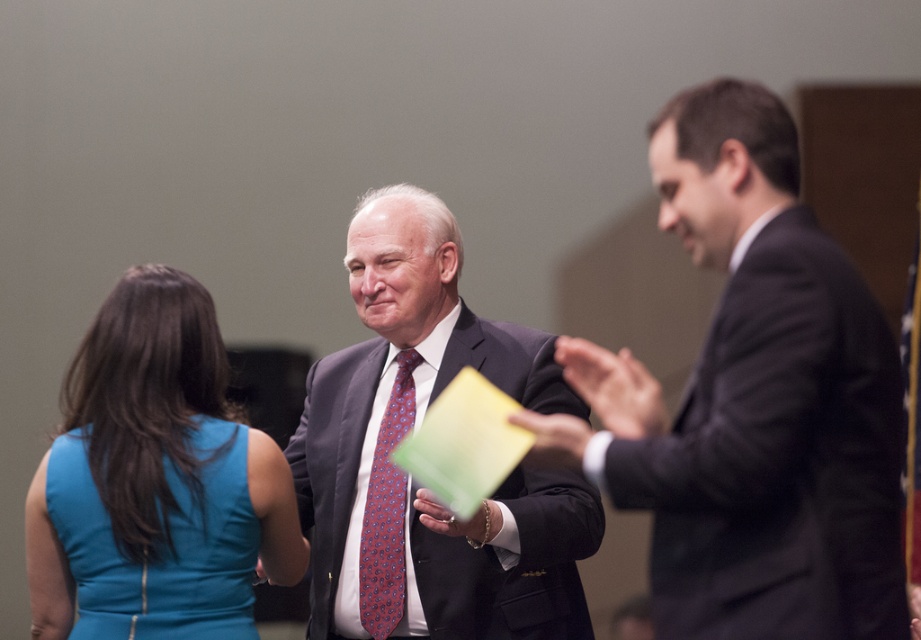
You are standing in the scene and want to move from the point at coordinates point (90, 445) to the point at coordinates point (383, 483). Which direction should you move to get closer to your destination?

To move from point (90, 445) to point (383, 483), you should move upward and to the right since point (90, 445) is in front of point (383, 483).

You are standing in the center of the image and want to move towards the dark gray suit at right. Which direction should you move to reach it?

Since the dark gray suit at right is located at point 0.628 on the x and 0.818 on the y, moving towards the right and slightly upwards would lead you to the dark gray suit at right.